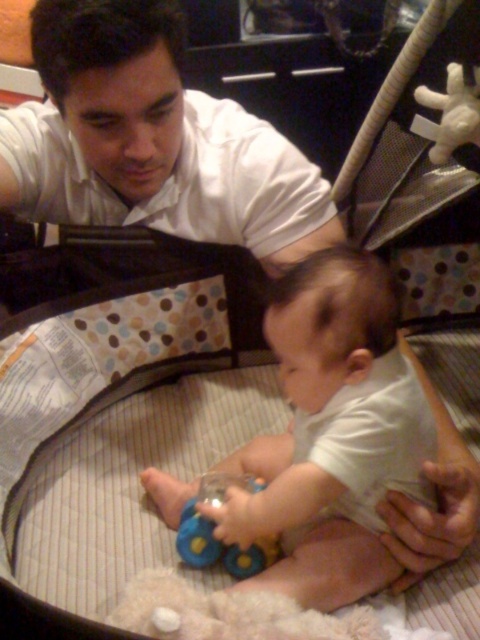
Between white smooth shirt at upper left and blue rubber toy at center, which one is positioned lower?

Positioned lower is blue rubber toy at center.

Which is behind, point (92, 8) or point (181, 556)?

The point (181, 556) is behind.

Is point (142, 163) closer to viewer compared to point (207, 484)?

No.

Where is `white smooth shirt at upper left`? white smooth shirt at upper left is located at coordinates (151, 140).

Is white smooth shirt at upper left bigger than white matte baby at center?

Result: Yes.

Locate an element on the screen. The height and width of the screenshot is (640, 480). white smooth shirt at upper left is located at coordinates (151, 140).

Identify the location of white smooth shirt at upper left. (151, 140).

This screenshot has width=480, height=640. I want to click on white smooth shirt at upper left, so click(151, 140).

Does white matte baby at center appear over blue rubber toy at center?

Indeed, white matte baby at center is positioned over blue rubber toy at center.

Is point (337, 598) closer to camera compared to point (228, 572)?

Yes.

Who is more forward, (292, 548) or (252, 570)?

Point (252, 570) is more forward.

Locate an element on the screen. white matte baby at center is located at coordinates (332, 433).